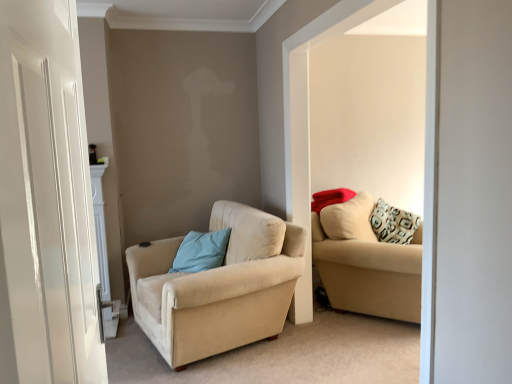
The image size is (512, 384). Identify the location of beige fabric couch at right, the first studio couch from the right. (366, 263).

The width and height of the screenshot is (512, 384). I want to click on beige fabric couch at right, the 2th studio couch positioned from the left, so click(366, 263).

Between beige fabric couch at right, the first studio couch from the right, and beige fabric couch at right, which one has larger width?

beige fabric couch at right, the first studio couch from the right.

Looking at this image, does beige fabric couch at right, the 2th studio couch positioned from the left, have a smaller size compared to beige fabric couch at right?

Actually, beige fabric couch at right, the 2th studio couch positioned from the left, might be larger than beige fabric couch at right.

Is beige fabric couch at right, the first studio couch from the right, in contact with beige fabric couch at right?

No, beige fabric couch at right, the first studio couch from the right, is not beside beige fabric couch at right.

From a real-world perspective, is beige fabric couch at right, the first studio couch from the right, on top of beige fabric couch at right?

No, from a real-world perspective, beige fabric couch at right, the first studio couch from the right, is not over beige fabric couch at right

Locate an element on the screen. pillow above the beige fabric armchair at left, which is counted as the 2th studio couch, starting from the right (from a real-world perspective) is located at coordinates (201, 251).

From a real-world perspective, relative to light blue fabric pillow at center-left, is beige fabric armchair at left, acting as the 1th studio couch starting from the left, vertically above or below?

beige fabric armchair at left, acting as the 1th studio couch starting from the left, is below light blue fabric pillow at center-left.

Measure the distance between beige fabric armchair at left, acting as the 1th studio couch starting from the left, and light blue fabric pillow at center-left.

beige fabric armchair at left, acting as the 1th studio couch starting from the left, and light blue fabric pillow at center-left are 12.98 inches apart from each other.

From the image's perspective, who appears lower, beige fabric armchair at left, which is counted as the 2th studio couch, starting from the right, or light blue fabric pillow at center-left?

beige fabric armchair at left, which is counted as the 2th studio couch, starting from the right, appears lower in the image.

From a real-world perspective, who is located higher, white glossy door at left or beige fabric armchair at left, which is counted as the 2th studio couch, starting from the right?

white glossy door at left, from a real-world perspective.

Can you tell me how much white glossy door at left and beige fabric armchair at left, acting as the 1th studio couch starting from the left, differ in facing direction?

The angle between the facing direction of white glossy door at left and the facing direction of beige fabric armchair at left, acting as the 1th studio couch starting from the left, is 165 degrees.

Considering the relative positions of white glossy door at left and beige fabric armchair at left, which is counted as the 2th studio couch, starting from the right, in the image provided, is white glossy door at left behind beige fabric armchair at left, which is counted as the 2th studio couch, starting from the right,?

No, white glossy door at left is in front of beige fabric armchair at left, which is counted as the 2th studio couch, starting from the right.

Is beige fabric armchair at left, which is counted as the 2th studio couch, starting from the right, at the back of white glossy door at left?

No, beige fabric armchair at left, which is counted as the 2th studio couch, starting from the right, is not at the back of white glossy door at left.

Is beige fabric couch at right at the right side of light blue fabric pillow at center-left?

Indeed, beige fabric couch at right is positioned on the right side of light blue fabric pillow at center-left.

From a real-world perspective, is beige fabric couch at right physically located above or below light blue fabric pillow at center-left?

beige fabric couch at right is situated higher than light blue fabric pillow at center-left in the real world.

Is beige fabric couch at right next to light blue fabric pillow at center-left?

No, beige fabric couch at right is not touching light blue fabric pillow at center-left.

Is beige fabric couch at right taller than light blue fabric pillow at center-left?

Yes, beige fabric couch at right is taller than light blue fabric pillow at center-left.

Are white glossy door at left and beige fabric couch at right, the 2th studio couch positioned from the left, beside each other?

white glossy door at left is not next to beige fabric couch at right, the 2th studio couch positioned from the left, and they're not touching.

Locate an element on the screen. This screenshot has width=512, height=384. the 1st studio couch positioned below the white glossy door at left (from the image's perspective) is located at coordinates (366, 263).

Could you tell me if white glossy door at left is turned towards beige fabric couch at right, the first studio couch from the right?

No, white glossy door at left is not aimed at beige fabric couch at right, the first studio couch from the right.

Is beige fabric couch at right, the 2th studio couch positioned from the left, surrounded by beige fabric armchair at left, which is counted as the 2th studio couch, starting from the right?

No, beige fabric couch at right, the 2th studio couch positioned from the left, is located outside of beige fabric armchair at left, which is counted as the 2th studio couch, starting from the right.

Considering their positions, is beige fabric armchair at left, which is counted as the 2th studio couch, starting from the right, located in front of or behind beige fabric couch at right, the first studio couch from the right?

beige fabric armchair at left, which is counted as the 2th studio couch, starting from the right, is in front of beige fabric couch at right, the first studio couch from the right.

Between beige fabric armchair at left, acting as the 1th studio couch starting from the left, and beige fabric couch at right, the 2th studio couch positioned from the left, which one appears on the left side from the viewer's perspective?

beige fabric armchair at left, acting as the 1th studio couch starting from the left.

From the picture: Which of these two, beige fabric armchair at left, acting as the 1th studio couch starting from the left, or beige fabric couch at right, stands taller?

With more height is beige fabric couch at right.

Does beige fabric armchair at left, which is counted as the 2th studio couch, starting from the right, have a lesser width compared to beige fabric couch at right?

No.

Does beige fabric armchair at left, acting as the 1th studio couch starting from the left, lie behind beige fabric couch at right?

Yes.

Which point is more forward, (250,216) or (404,205)?

The point (250,216) is in front.

Where is `window above the beige fabric couch at right, the 2th studio couch positioned from the left (from the image's perspective)`? window above the beige fabric couch at right, the 2th studio couch positioned from the left (from the image's perspective) is located at coordinates (362, 154).

The width and height of the screenshot is (512, 384). Find the location of `pillow behind the beige fabric armchair at left, acting as the 1th studio couch starting from the left`. pillow behind the beige fabric armchair at left, acting as the 1th studio couch starting from the left is located at coordinates [x=201, y=251].

Based on their spatial positions, is beige fabric couch at right or beige fabric couch at right, the 2th studio couch positioned from the left, closer to light blue fabric pillow at center-left?

beige fabric couch at right, the 2th studio couch positioned from the left, is positioned closer to the anchor light blue fabric pillow at center-left.

Estimate the real-world distances between objects in this image. Which object is further from beige fabric armchair at left, which is counted as the 2th studio couch, starting from the right, beige fabric couch at right or white glossy door at left?

white glossy door at left is further to beige fabric armchair at left, which is counted as the 2th studio couch, starting from the right.

Looking at the image, which one is located closer to light blue fabric pillow at center-left, beige fabric couch at right or white glossy door at left?

beige fabric couch at right is positioned closer to the anchor light blue fabric pillow at center-left.

Which object lies further to the anchor point beige fabric couch at right, light blue fabric pillow at center-left or white glossy door at left?

white glossy door at left is further to beige fabric couch at right.

Considering their positions, is white glossy door at left positioned further to beige fabric armchair at left, acting as the 1th studio couch starting from the left, than beige fabric couch at right, the first studio couch from the right?

white glossy door at left.

Based on their spatial positions, is beige fabric couch at right or beige fabric armchair at left, which is counted as the 2th studio couch, starting from the right, closer to light blue fabric pillow at center-left?

beige fabric armchair at left, which is counted as the 2th studio couch, starting from the right, is positioned closer to the anchor light blue fabric pillow at center-left.

From the image, which object appears to be farther from beige fabric couch at right, beige fabric armchair at left, acting as the 1th studio couch starting from the left, or white glossy door at left?

Among the two, white glossy door at left is located further to beige fabric couch at right.

When comparing their distances from beige fabric armchair at left, which is counted as the 2th studio couch, starting from the right, does light blue fabric pillow at center-left or beige fabric couch at right seem further?

beige fabric couch at right lies further to beige fabric armchair at left, which is counted as the 2th studio couch, starting from the right, than the other object.

This screenshot has height=384, width=512. In order to click on window between white glossy door at left and beige fabric armchair at left, which is counted as the 2th studio couch, starting from the right, along the z-axis in this screenshot , I will do `click(362, 154)`.

Locate an element on the screen. studio couch between light blue fabric pillow at center-left and beige fabric couch at right, the 2th studio couch positioned from the left, in the horizontal direction is located at coordinates [218, 286].

Where is `studio couch positioned between beige fabric couch at right and beige fabric couch at right, the first studio couch from the right, from near to far`? This screenshot has height=384, width=512. studio couch positioned between beige fabric couch at right and beige fabric couch at right, the first studio couch from the right, from near to far is located at coordinates (218, 286).

You are a GUI agent. You are given a task and a screenshot of the screen. Output one action in this format:
    pyautogui.click(x=<x>, y=<y>)
    Task: Click on the window positioned between white glossy door at left and beige fabric couch at right, the 2th studio couch positioned from the left, from near to far
    The width and height of the screenshot is (512, 384).
    Given the screenshot: What is the action you would take?
    pyautogui.click(x=362, y=154)